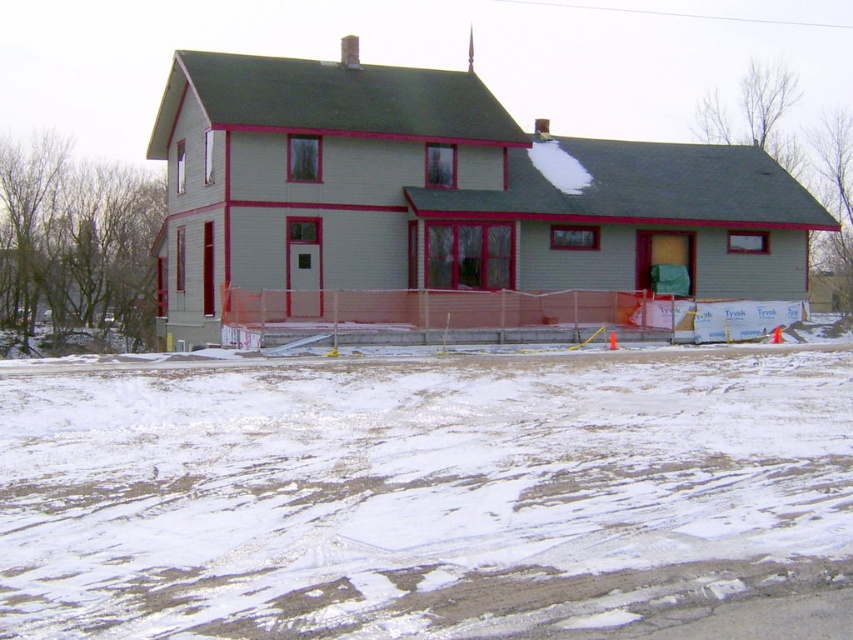
Looking at this image, you are a delivery person trying to park your van in front of the light gray wood house at center. The van requires a clear space free of the white powdery snow at lower center. Is there enough space to park the van without the snow blocking the area?

The white powdery snow at lower center is positioned under the light gray wood house at center, meaning the snow is directly beneath the house and likely not obstructing the front area where the van would park. Therefore, there should be enough space to park the van without the snow blocking the area.

You are a delivery person trying to reach the front door of the light gray wood house at center. The path to the door is covered by the white powdery snow at lower center. Can you walk through the snow to reach the door?

The white powdery snow at lower center has a smaller size compared to light gray wood house at center, but the snow is covering the path to the door. Since the snow is present on the ground, you can walk through it to reach the door unless it is too deep or slippery. The description does not mention depth or slipperiness, so assume it is passable.

You are a delivery person trying to reach the light gray wood house at center. There is white powdery snow at lower center in your path. Can you walk directly to the house without stepping on the snow?

The white powdery snow at lower center has a lesser height compared to light gray wood house at center. Since the snow is lower than the house, you can walk directly to the light gray wood house at center without stepping on the snow.